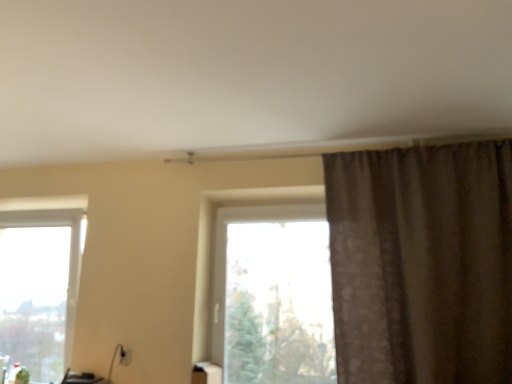
This screenshot has height=384, width=512. What do you see at coordinates (206, 373) in the screenshot?
I see `white glossy tissue box at lower center` at bounding box center [206, 373].

Describe the element at coordinates (39, 288) in the screenshot. I see `clear glass window at lower left, the 2th window in the right-to-left sequence` at that location.

Image resolution: width=512 pixels, height=384 pixels. What are the coordinates of `white glossy tissue box at lower center` in the screenshot? It's located at click(x=206, y=373).

From the image's perspective, is white glossy tissue box at lower center above brown textured curtain at upper right?

No, from the image's perspective, white glossy tissue box at lower center is not over brown textured curtain at upper right.

Are white glossy tissue box at lower center and brown textured curtain at upper right located far from each other?

That's right, there is a large distance between white glossy tissue box at lower center and brown textured curtain at upper right.

Considering the relative sizes of white glossy tissue box at lower center and brown textured curtain at upper right in the image provided, is white glossy tissue box at lower center taller than brown textured curtain at upper right?

Incorrect, the height of white glossy tissue box at lower center is not larger of that of brown textured curtain at upper right.

Is brown textured curtain at upper right at the back of clear glass window at lower left, the 1th window from the left?

No, clear glass window at lower left, the 1th window from the left, is not facing away from brown textured curtain at upper right.

Which object is closer to the camera taking this photo, clear glass window at lower left, the 1th window from the left, or brown textured curtain at upper right?

brown textured curtain at upper right is closer to the camera.

Are clear glass window at lower left, the 2th window in the right-to-left sequence, and brown textured curtain at upper right far apart?

clear glass window at lower left, the 2th window in the right-to-left sequence, is positioned a significant distance from brown textured curtain at upper right.

Considering the sizes of objects clear glass window at lower left, the 2th window in the right-to-left sequence, and brown textured curtain at upper right in the image provided, who is shorter, clear glass window at lower left, the 2th window in the right-to-left sequence, or brown textured curtain at upper right?

clear glass window at lower left, the 2th window in the right-to-left sequence, is shorter.

From the image's perspective, is clear glass window at lower left, the 1th window from the left, below transparent glass window at center, which appears as the first window when viewed from the right?

Yes.

Is clear glass window at lower left, the 2th window in the right-to-left sequence, not inside transparent glass window at center, acting as the second window starting from the left?

Indeed, clear glass window at lower left, the 2th window in the right-to-left sequence, is completely outside transparent glass window at center, acting as the second window starting from the left.

Does point (2, 337) come farther from viewer compared to point (262, 354)?

Yes, it is.

From the picture: Which is more to the right, clear glass window at lower left, the 2th window in the right-to-left sequence, or transparent glass window at center, acting as the second window starting from the left?

From the viewer's perspective, transparent glass window at center, acting as the second window starting from the left, appears more on the right side.

Is clear glass window at lower left, the 2th window in the right-to-left sequence, located outside white glossy tissue box at lower center?

Yes, clear glass window at lower left, the 2th window in the right-to-left sequence, is not within white glossy tissue box at lower center.

Considering the relative sizes of clear glass window at lower left, the 2th window in the right-to-left sequence, and white glossy tissue box at lower center in the image provided, is clear glass window at lower left, the 2th window in the right-to-left sequence, thinner than white glossy tissue box at lower center?

No.

Considering the positions of objects clear glass window at lower left, the 1th window from the left, and white glossy tissue box at lower center in the image provided, who is more to the right, clear glass window at lower left, the 1th window from the left, or white glossy tissue box at lower center?

From the viewer's perspective, white glossy tissue box at lower center appears more on the right side.

At what (x,y) coordinates should I click in order to perform the action: click on window lying on the left of white glossy tissue box at lower center. Please return your answer as a coordinate pair (x, y). The width and height of the screenshot is (512, 384). Looking at the image, I should click on (39, 288).

Which object is positioned more to the right, white glossy tissue box at lower center or clear glass window at lower left, the 2th window in the right-to-left sequence?

Positioned to the right is white glossy tissue box at lower center.

Who is more distant, white glossy tissue box at lower center or clear glass window at lower left, the 2th window in the right-to-left sequence?

Positioned behind is clear glass window at lower left, the 2th window in the right-to-left sequence.

Considering the positions of objects brown textured curtain at upper right and clear glass window at lower left, the 2th window in the right-to-left sequence, in the image provided, who is behind, brown textured curtain at upper right or clear glass window at lower left, the 2th window in the right-to-left sequence,?

clear glass window at lower left, the 2th window in the right-to-left sequence, is further from the camera.

Can you tell me how much brown textured curtain at upper right and clear glass window at lower left, the 1th window from the left, differ in facing direction?

There is a 0.88-degree angle between the facing directions of brown textured curtain at upper right and clear glass window at lower left, the 1th window from the left.

From a real-world perspective, is brown textured curtain at upper right on clear glass window at lower left, the 1th window from the left?

Yes, from a real-world perspective, brown textured curtain at upper right is above clear glass window at lower left, the 1th window from the left.

Is there a large distance between brown textured curtain at upper right and clear glass window at lower left, the 1th window from the left?

Yes, brown textured curtain at upper right and clear glass window at lower left, the 1th window from the left, are located far from each other.

From the image's perspective, which object appears higher, transparent glass window at center, which appears as the first window when viewed from the right, or brown textured curtain at upper right?

brown textured curtain at upper right.

From the picture: Between transparent glass window at center, acting as the second window starting from the left, and brown textured curtain at upper right, which one has smaller size?

transparent glass window at center, acting as the second window starting from the left, is smaller.

I want to click on furniture that appears below the brown textured curtain at upper right (from the image's perspective), so click(206, 373).

The image size is (512, 384). What are the coordinates of `curtain above the clear glass window at lower left, the 2th window in the right-to-left sequence (from a real-world perspective)` in the screenshot? It's located at (422, 263).

Looking at the image, which one is located further to brown textured curtain at upper right, clear glass window at lower left, the 1th window from the left, or transparent glass window at center, which appears as the first window when viewed from the right?

The object further to brown textured curtain at upper right is clear glass window at lower left, the 1th window from the left.

In the scene shown: Which object lies nearer to the anchor point white glossy tissue box at lower center, transparent glass window at center, acting as the second window starting from the left, or clear glass window at lower left, the 2th window in the right-to-left sequence?

transparent glass window at center, acting as the second window starting from the left.

From the image, which object appears to be nearer to clear glass window at lower left, the 2th window in the right-to-left sequence, white glossy tissue box at lower center or transparent glass window at center, acting as the second window starting from the left?

white glossy tissue box at lower center.

Which object lies further to the anchor point transparent glass window at center, which appears as the first window when viewed from the right, brown textured curtain at upper right or clear glass window at lower left, the 1th window from the left?

clear glass window at lower left, the 1th window from the left.

Looking at the image, which one is located closer to clear glass window at lower left, the 1th window from the left, brown textured curtain at upper right or white glossy tissue box at lower center?

Among the two, white glossy tissue box at lower center is located nearer to clear glass window at lower left, the 1th window from the left.

Looking at the image, which one is located closer to clear glass window at lower left, the 1th window from the left, transparent glass window at center, which appears as the first window when viewed from the right, or brown textured curtain at upper right?

Among the two, transparent glass window at center, which appears as the first window when viewed from the right, is located nearer to clear glass window at lower left, the 1th window from the left.

Estimate the real-world distances between objects in this image. Which object is further from white glossy tissue box at lower center, clear glass window at lower left, the 1th window from the left, or brown textured curtain at upper right?

clear glass window at lower left, the 1th window from the left, is positioned further to the anchor white glossy tissue box at lower center.

From the image, which object appears to be nearer to white glossy tissue box at lower center, clear glass window at lower left, the 2th window in the right-to-left sequence, or transparent glass window at center, acting as the second window starting from the left?

transparent glass window at center, acting as the second window starting from the left, lies closer to white glossy tissue box at lower center than the other object.

Find the location of a particular element. window between clear glass window at lower left, the 1th window from the left, and brown textured curtain at upper right is located at coordinates (273, 295).

Identify the location of furniture between clear glass window at lower left, the 1th window from the left, and transparent glass window at center, acting as the second window starting from the left, from left to right. Image resolution: width=512 pixels, height=384 pixels. (206, 373).

This screenshot has width=512, height=384. What are the coordinates of `window situated between white glossy tissue box at lower center and brown textured curtain at upper right from left to right` in the screenshot? It's located at (273, 295).

Find the location of a particular element. This screenshot has height=384, width=512. furniture between clear glass window at lower left, the 1th window from the left, and brown textured curtain at upper right is located at coordinates (206, 373).